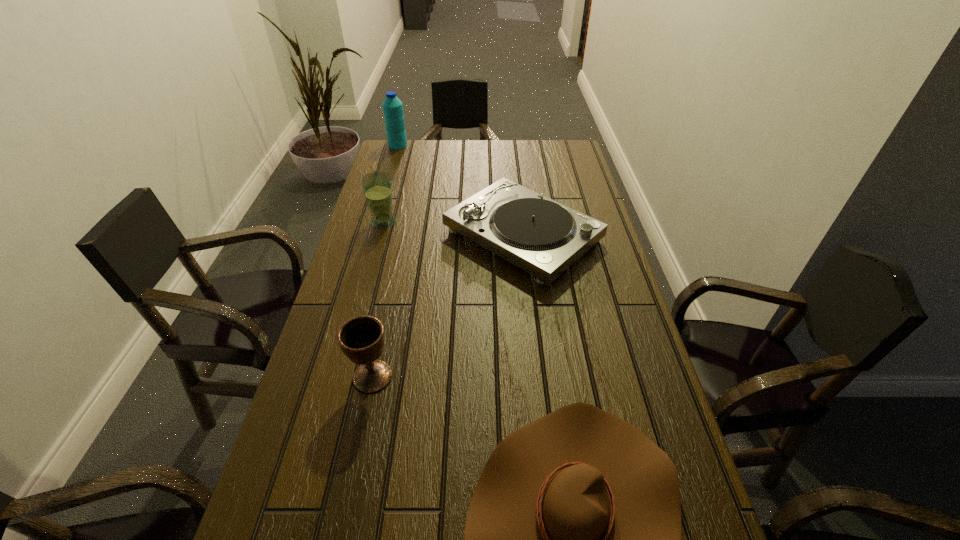
Find the location of a particular element. The height and width of the screenshot is (540, 960). the tallest object is located at coordinates (392, 107).

Locate an element on the screen. water bottle is located at coordinates (392, 107).

Find the location of a particular element. The width and height of the screenshot is (960, 540). glass is located at coordinates (377, 186).

Identify the location of the second nearest object. The height and width of the screenshot is (540, 960). (361, 339).

Find the location of a particular element. This screenshot has height=540, width=960. record player is located at coordinates (543, 237).

This screenshot has height=540, width=960. Find the location of `vacant region located on the right of the water bottle`. vacant region located on the right of the water bottle is located at coordinates (440, 145).

Locate an element on the screen. This screenshot has width=960, height=540. vacant area located 0.120m on the back of the glass is located at coordinates (391, 195).

This screenshot has width=960, height=540. Identify the location of vacant region located on the back of the fourth farthest object. (397, 256).

The height and width of the screenshot is (540, 960). In order to click on free space located 0.120m on the left of the fourth tallest object in this screenshot , I will do `click(406, 236)`.

Locate an element on the screen. object located at the far edge is located at coordinates (392, 107).